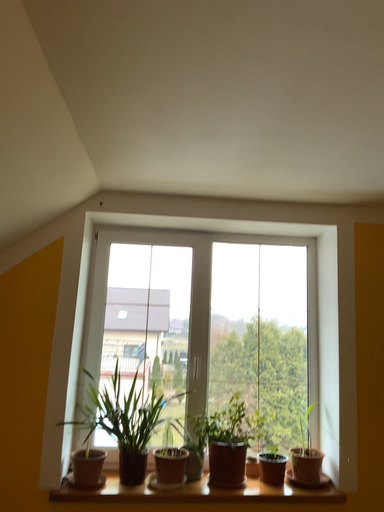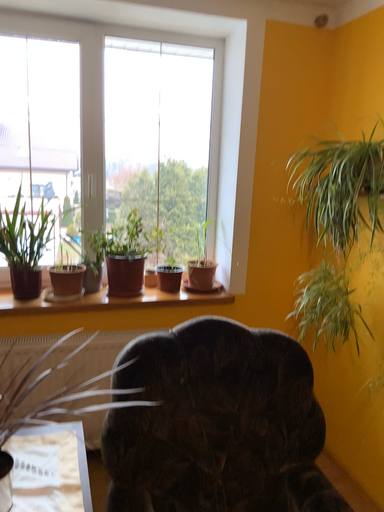
Question: How did the camera likely rotate when shooting the video?

Choices:
 (A) rotated right
 (B) rotated left

Answer: (A)